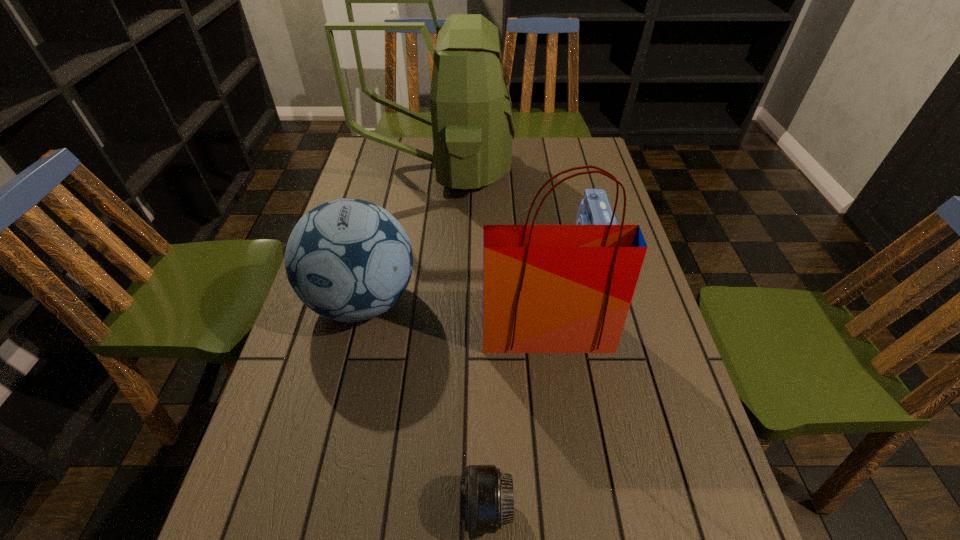
Identify the location of object present at the far edge. This screenshot has width=960, height=540. click(x=472, y=120).

In order to click on backpack at the left edge in this screenshot , I will do `click(472, 120)`.

Identify the location of soccer ball present at the left edge. (348, 260).

This screenshot has height=540, width=960. I want to click on shopping bag present at the right edge, so (x=546, y=288).

I want to click on camera that is positioned at the right edge, so click(594, 209).

Find the location of a particular element. This screenshot has height=540, width=960. object that is at the far left corner is located at coordinates (472, 120).

Where is `vacant region at the far edge of the desktop`? The width and height of the screenshot is (960, 540). vacant region at the far edge of the desktop is located at coordinates point(422,147).

You are a GUI agent. You are given a task and a screenshot of the screen. Output one action in this format:
    pyautogui.click(x=<x>, y=<y>)
    Task: Click on the vacant area at the left edge of the desktop
    The image size is (960, 540).
    Given the screenshot: What is the action you would take?
    pyautogui.click(x=279, y=534)

Where is `unoccupied area between the farthest object and the camera`? This screenshot has width=960, height=540. unoccupied area between the farthest object and the camera is located at coordinates (516, 207).

The width and height of the screenshot is (960, 540). Find the location of `blank region between the shopping bag and the third shortest object`. blank region between the shopping bag and the third shortest object is located at coordinates (455, 317).